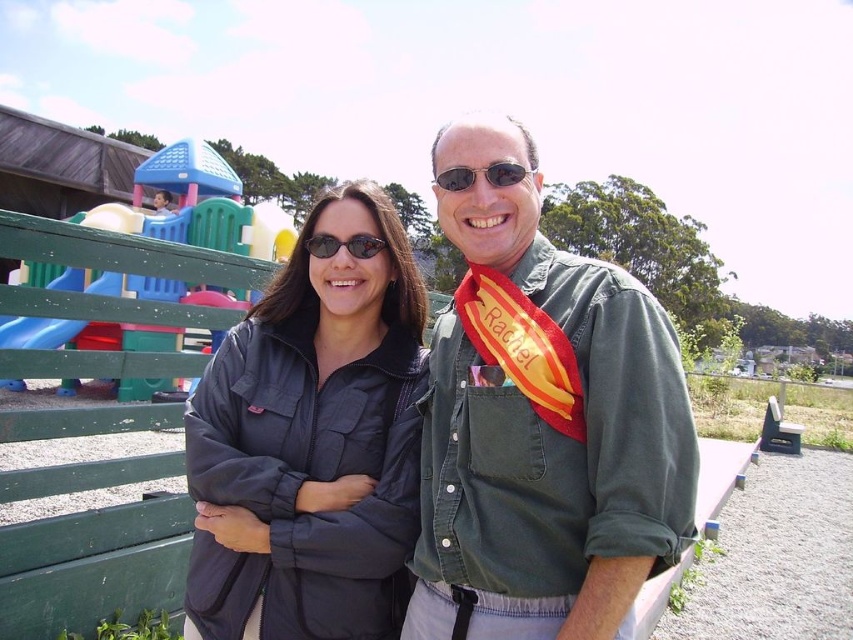
Question: Does green denim shirt at center lie behind black plastic sunglasses at center?

Choices:
 (A) no
 (B) yes

Answer: (A)

Question: Which of the following is the closest to the observer?

Choices:
 (A) green denim shirt at center
 (B) black plastic sunglasses at center
 (C) sunglasses at center
 (D) matte black jacket at center

Answer: (A)

Question: Which object appears farthest from the camera in this image?

Choices:
 (A) matte black jacket at center
 (B) green denim shirt at center

Answer: (A)

Question: Which point is closer to the camera?

Choices:
 (A) matte black jacket at center
 (B) black plastic sunglasses at center
 (C) sunglasses at center

Answer: (C)

Question: Can you confirm if green denim shirt at center is positioned to the right of matte black jacket at center?

Choices:
 (A) yes
 (B) no

Answer: (A)

Question: Can you confirm if green denim shirt at center is positioned below matte black jacket at center?

Choices:
 (A) yes
 (B) no

Answer: (B)